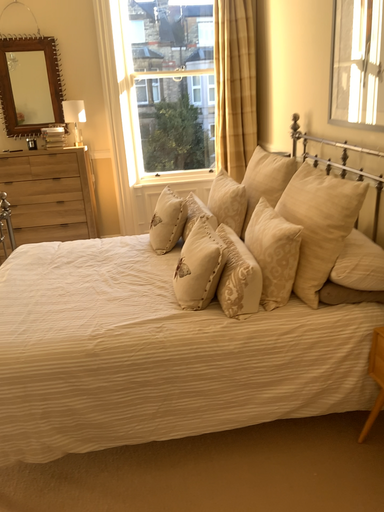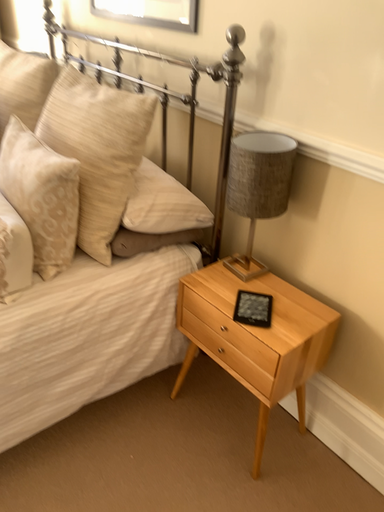
Question: Which way did the camera rotate in the video?

Choices:
 (A) rotated left
 (B) rotated right

Answer: (B)